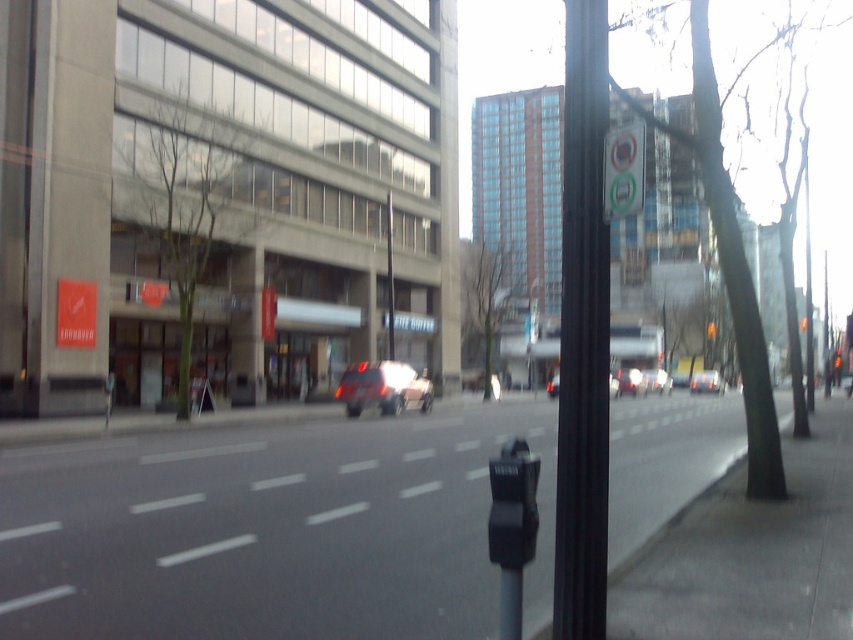
Looking at this image, which of these two, gray asphalt at center or black plastic parking meter at lower center, stands taller?

gray asphalt at center

Who is more distant from viewer, (329, 532) or (502, 628)?

The point (329, 532) is behind.

At what (x,y) coordinates should I click in order to perform the action: click on gray asphalt at center. Please return your answer as a coordinate pair (x, y). The height and width of the screenshot is (640, 853). Looking at the image, I should click on (268, 531).

The image size is (853, 640). I want to click on shiny red car at center, so click(x=383, y=387).

Does shiny red car at center have a larger size compared to matte red suv at center?

Incorrect, shiny red car at center is not larger than matte red suv at center.

The height and width of the screenshot is (640, 853). In order to click on shiny red car at center in this screenshot , I will do `click(383, 387)`.

Between black plastic parking meter at lower center and shiny red car at center, which one appears on the left side from the viewer's perspective?

shiny red car at center is more to the left.

Does point (521, 548) come closer to viewer compared to point (398, 396)?

Yes.

Where is `black plastic parking meter at lower center`? black plastic parking meter at lower center is located at coordinates (512, 525).